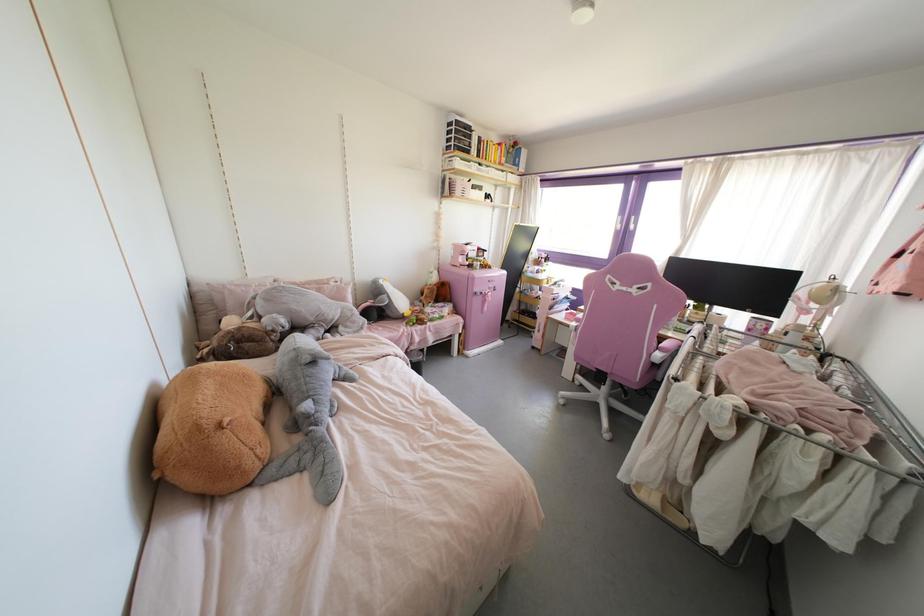
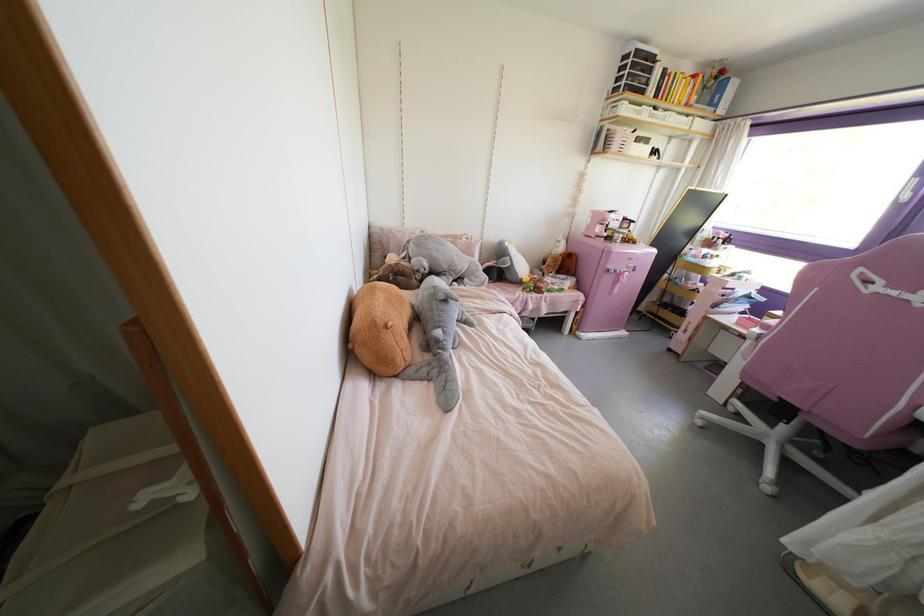
Find the pixel in the second image that matches (405,314) in the first image.

(523, 280)